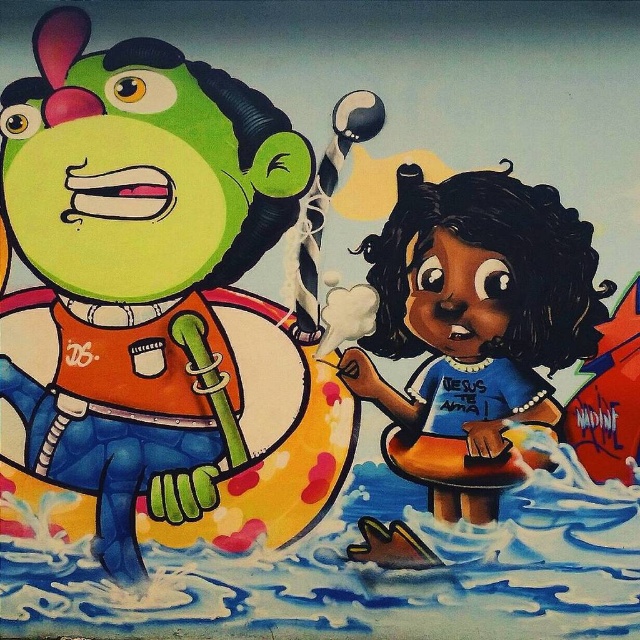
Question: Which point is farther to the camera?

Choices:
 (A) green rubber alien at left
 (B) smooth blue life preserver at center

Answer: (A)

Question: Can you confirm if green rubber alien at left is thinner than smooth blue life preserver at center?

Choices:
 (A) yes
 (B) no

Answer: (B)

Question: Is green rubber alien at left wider than smooth blue life preserver at center?

Choices:
 (A) yes
 (B) no

Answer: (A)

Question: Which point is farther from the camera taking this photo?

Choices:
 (A) [506, 440]
 (B) [234, 269]

Answer: (B)

Question: Can you confirm if green rubber alien at left is positioned to the right of smooth blue life preserver at center?

Choices:
 (A) no
 (B) yes

Answer: (A)

Question: Which of the following is the closest to the observer?

Choices:
 (A) (404, 339)
 (B) (116, 540)

Answer: (A)